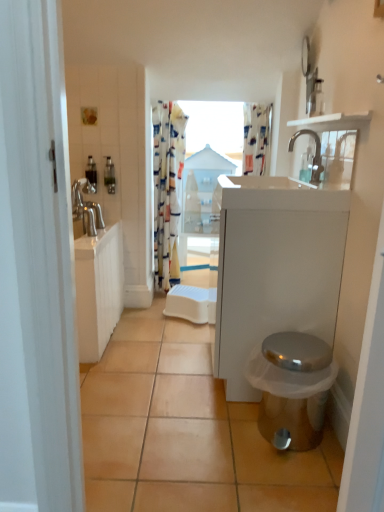
You are a GUI agent. You are given a task and a screenshot of the screen. Output one action in this format:
    pyautogui.click(x=<x>, y=<y>)
    Task: Click on the vacant area that is in front of white glossy cabinet at center
    Image resolution: width=384 pixels, height=512 pixels.
    Given the screenshot: What is the action you would take?
    pyautogui.click(x=229, y=441)